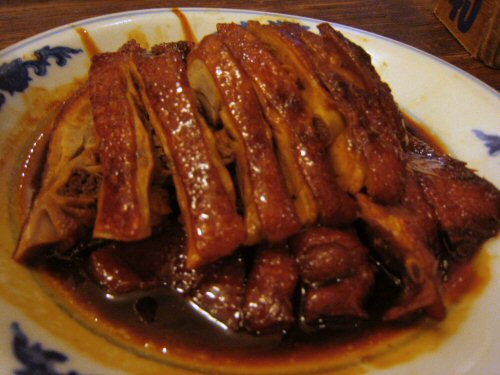
Where is `white plate`? The image size is (500, 375). white plate is located at coordinates (447, 107).